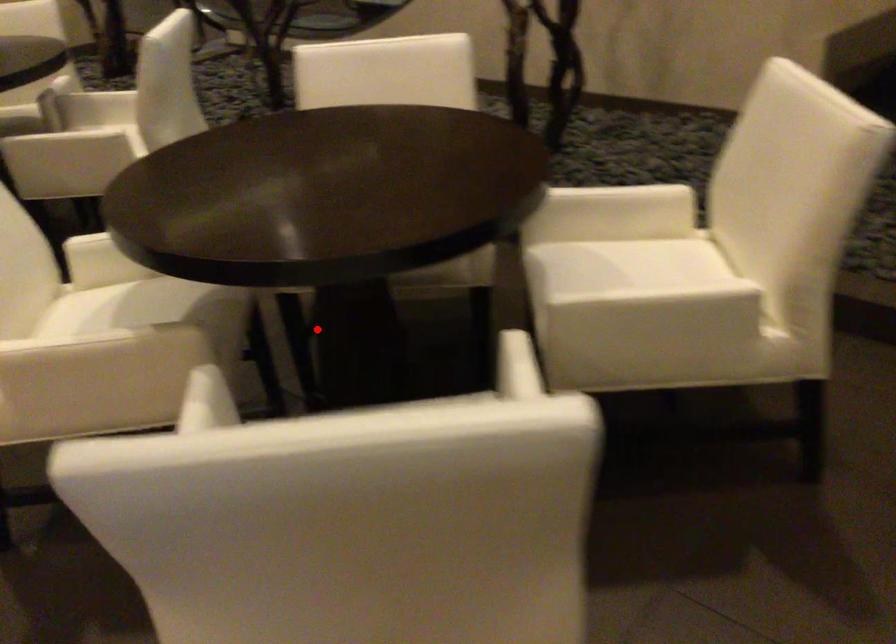
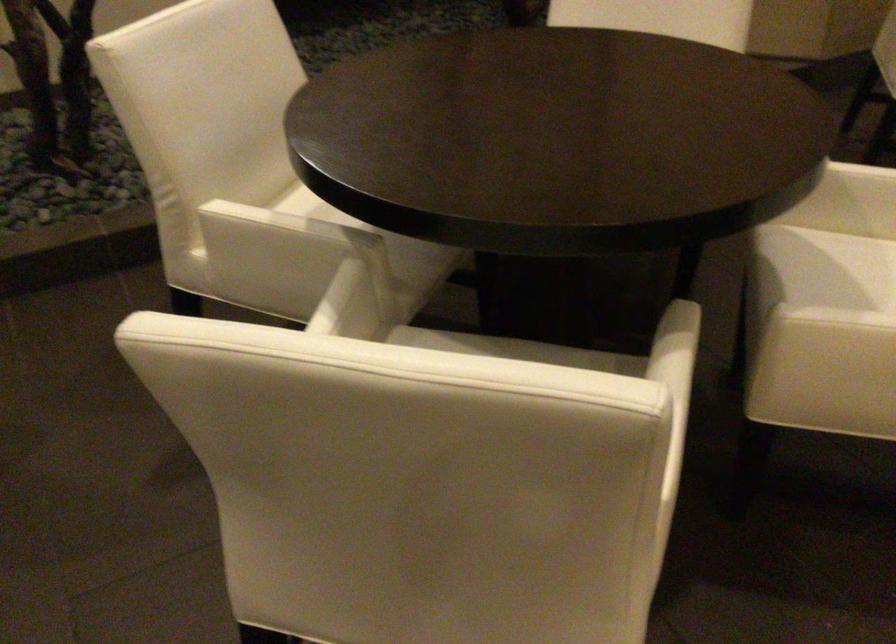
The point at the highlighted location is marked in the first image. Where is the corresponding point in the second image?

(505, 327)